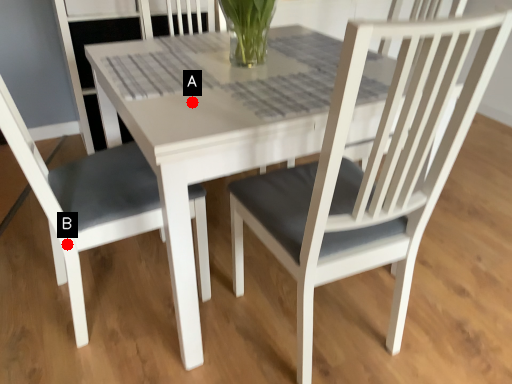
Question: Two points are circled on the image, labeled by A and B beside each circle. Among these points, which one is nearest to the camera?

Choices:
 (A) A is closer
 (B) B is closer

Answer: (A)